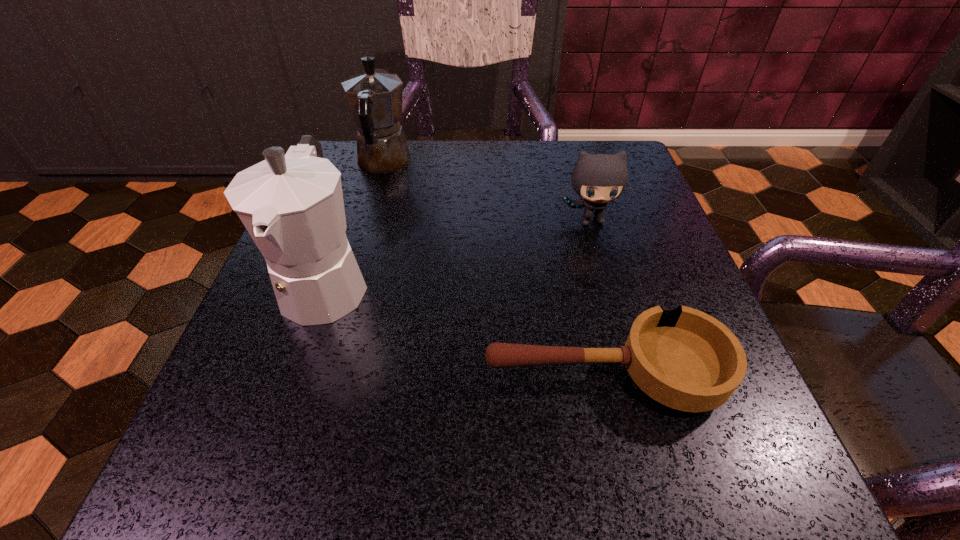
Identify the location of free spot between the nearer coffeepot and the kitten. (459, 251).

This screenshot has height=540, width=960. What are the coordinates of `unoccupied position between the kitten and the saucepan` in the screenshot? It's located at click(x=597, y=298).

Identify the location of free space between the nearer coffeepot and the shortest object. This screenshot has height=540, width=960. (465, 329).

At what (x,y) coordinates should I click in order to perform the action: click on free spot between the nearer coffeepot and the second shortest object. Please return your answer as a coordinate pair (x, y). Image resolution: width=960 pixels, height=540 pixels. Looking at the image, I should click on (459, 251).

Locate an element on the screen. vacant area that lies between the farthest object and the shortest object is located at coordinates (493, 269).

I want to click on free spot between the shortest object and the third nearest object, so click(x=597, y=298).

You are a GUI agent. You are given a task and a screenshot of the screen. Output one action in this format:
    pyautogui.click(x=<x>, y=<y>)
    Task: Click on the unoccupied position between the saucepan and the third tallest object
    
    Given the screenshot: What is the action you would take?
    pyautogui.click(x=597, y=298)

This screenshot has width=960, height=540. Find the location of `unoccupied position between the nearer coffeepot and the saucepan`. unoccupied position between the nearer coffeepot and the saucepan is located at coordinates (465, 329).

The image size is (960, 540). What are the coordinates of `vacant area that lies between the farthest object and the nearer coffeepot` in the screenshot? It's located at (355, 223).

Find the location of `the second closest object to the nearer coffeepot`. the second closest object to the nearer coffeepot is located at coordinates (685, 359).